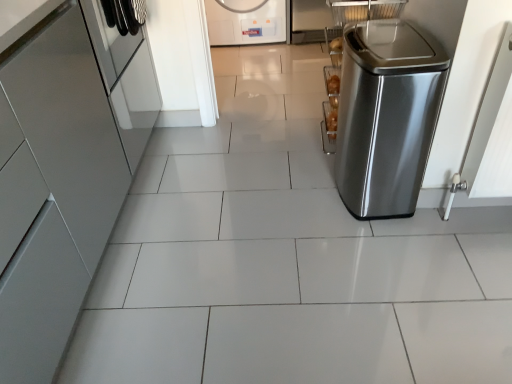
Identify the location of vacant space in front of stainless steel trash can at right, arranged as the 3th home appliance when viewed from the left. (390, 241).